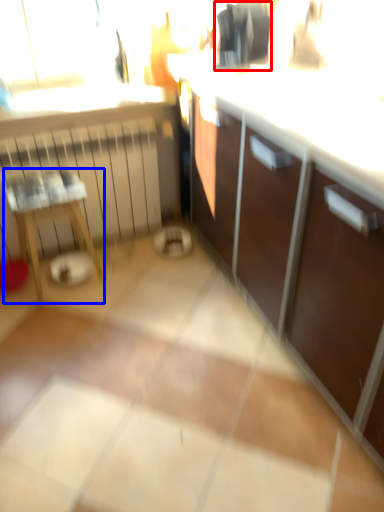
Question: Which point is closer to the camera, appliance (highlighted by a red box) or furniture (highlighted by a blue box)?

Choices:
 (A) appliance
 (B) furniture

Answer: (A)